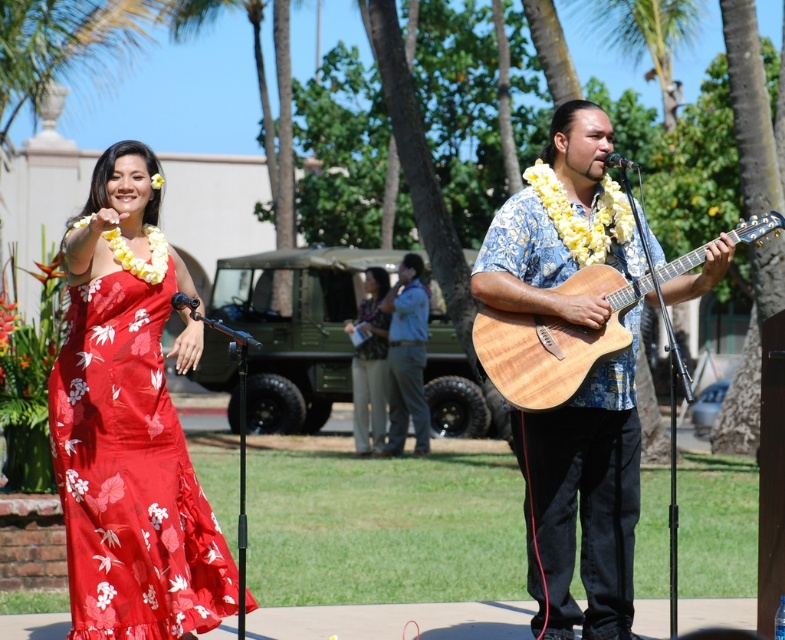
Question: Can you confirm if wooden acoustic guitar at center is thinner than green matte jeep at center?

Choices:
 (A) no
 (B) yes

Answer: (B)

Question: Which object appears farthest from the camera in this image?

Choices:
 (A) blue denim shirt at center
 (B) matte floral fabric dress at left

Answer: (A)

Question: Which object appears closest to the camera in this image?

Choices:
 (A) green matte jeep at center
 (B) matte khaki pants at center
 (C) blue denim shirt at center

Answer: (C)

Question: Which object is the farthest from the wooden acoustic guitar at center?

Choices:
 (A) matte floral fabric dress at left
 (B) natural wood guitar at center

Answer: (A)

Question: From the image, what is the correct spatial relationship of wooden acoustic guitar at center in relation to matte floral fabric dress at left?

Choices:
 (A) left
 (B) right

Answer: (B)

Question: Does wooden acoustic guitar at center have a lesser width compared to matte floral fabric dress at left?

Choices:
 (A) yes
 (B) no

Answer: (B)